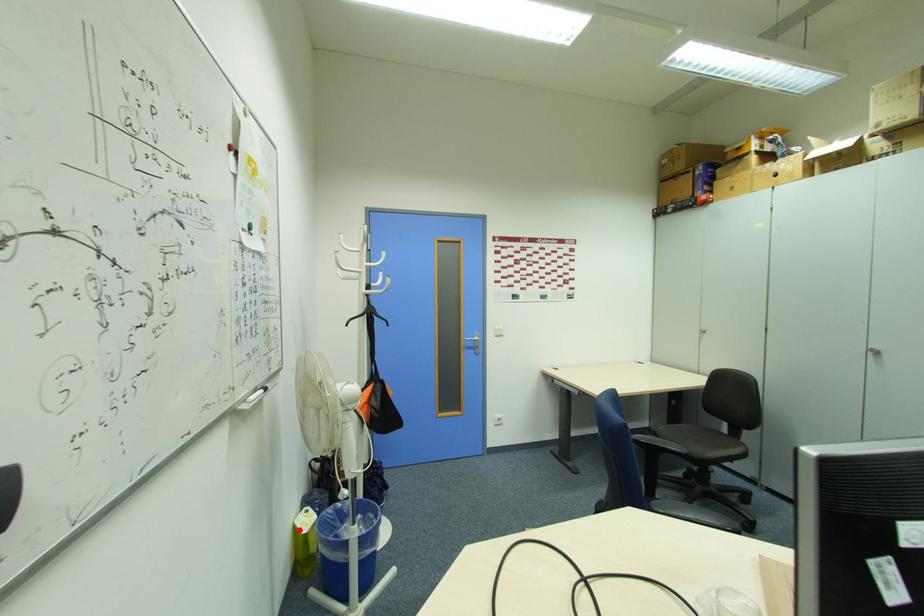
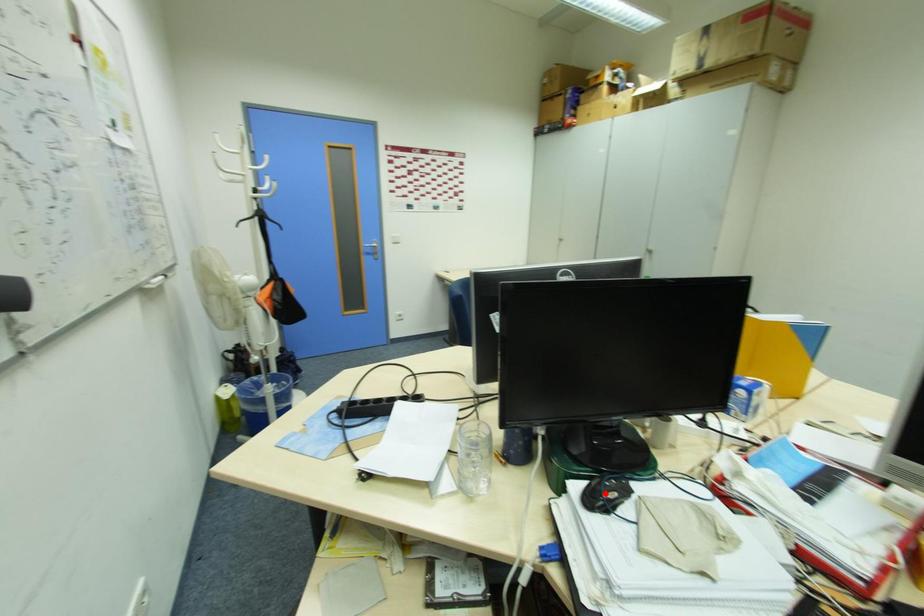
I am providing you with two images of the same scene from different viewpoints. A red point is marked on the first image and another point is marked on the second image. Are the points marked in image1 and image2 representing the same 3D position?

No